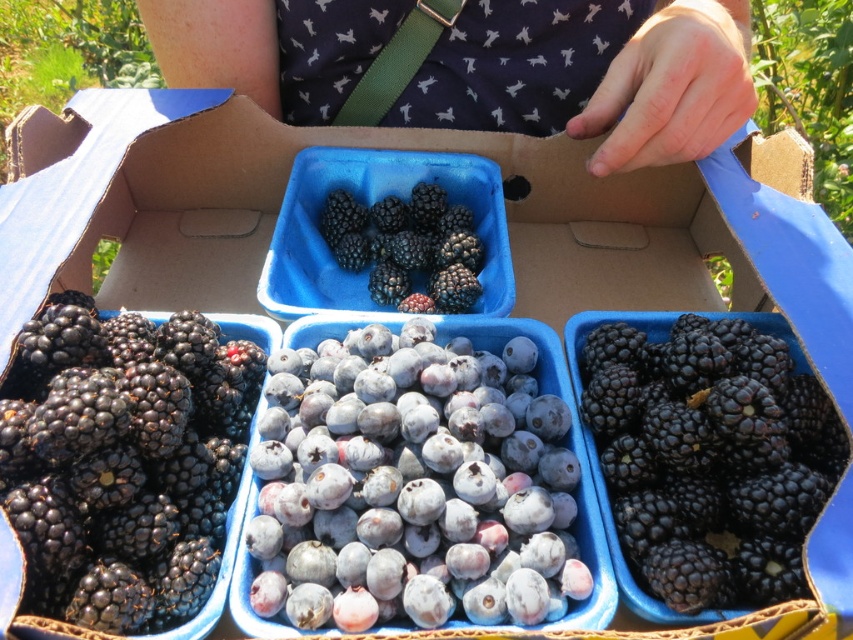
You are a delivery person checking the berries in the box. You notice two points marked on the box. One is at point (x=187, y=406) and the other at point (x=549, y=464). Which point is closer to you when you look at the box?

Point (x=187, y=406) is closer to you because it is further to the camera than point (x=549, y=464).

You are a delivery person standing 1 meter away from the cardboard box. You need to grab the shiny blackberries at right. Can you reach them without moving closer?

The shiny blackberries at right are 42.29 centimeters away from the viewer. Since you are standing 1 meter away, you are farther than the required distance to reach them, so you need to move closer.